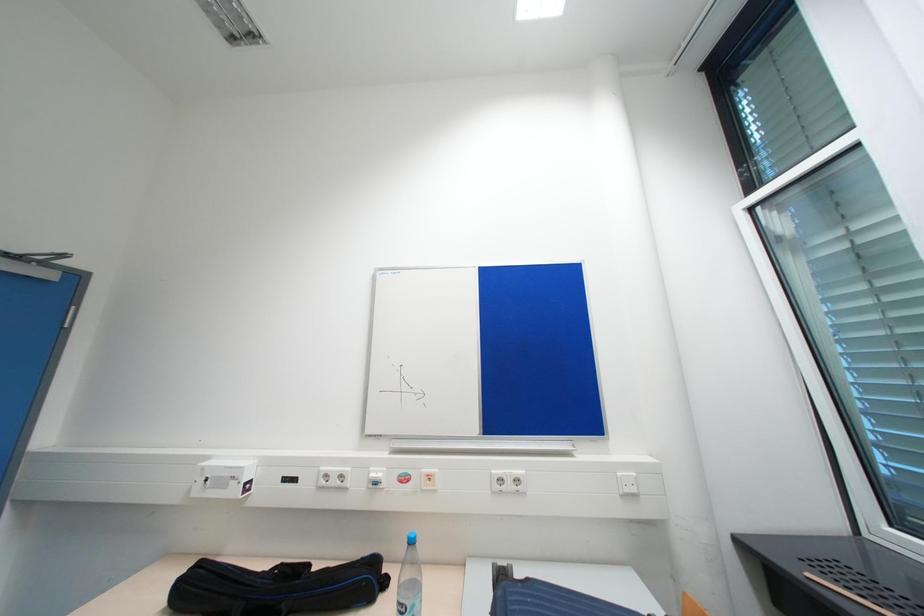
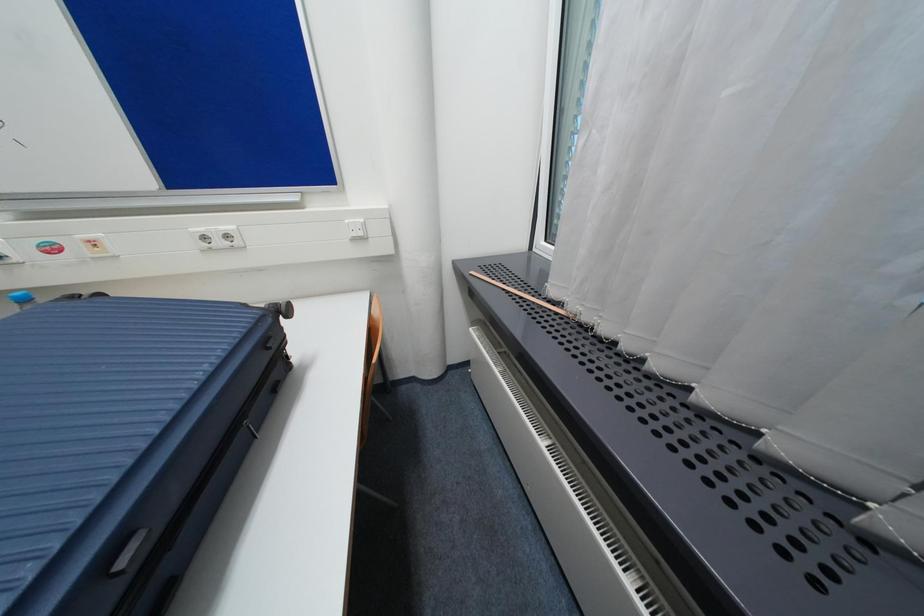
In the scene shown: The images are taken continuously from a first-person perspective. In which direction is your viewpoint rotating?

The camera rotated toward right-down.